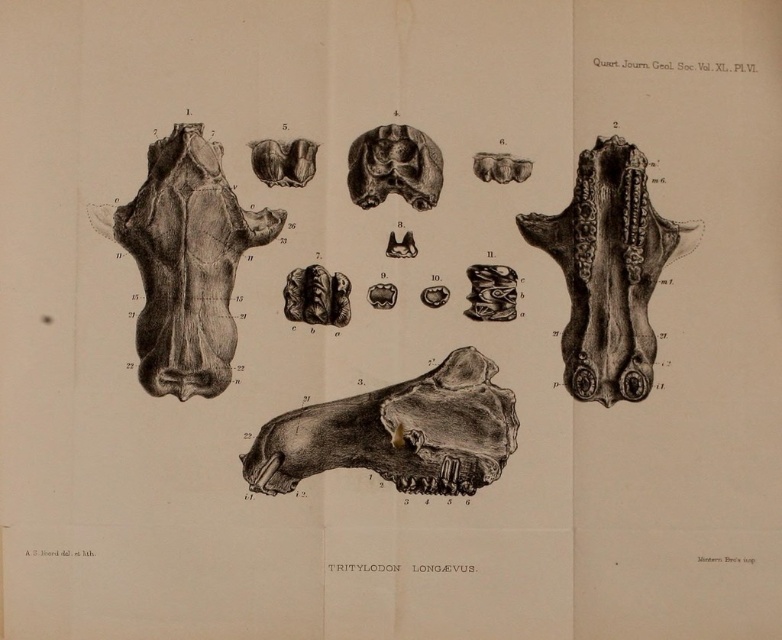
Question: Is black bone skull at upper left below gray textured bone at center?

Choices:
 (A) yes
 (B) no

Answer: (B)

Question: Can you confirm if gray textured bone at center is positioned to the left of black textured skull at right?

Choices:
 (A) yes
 (B) no

Answer: (A)

Question: Which object appears farthest from the camera in this image?

Choices:
 (A) black bone skull at upper left
 (B) black textured skull at center
 (C) gray textured bone at center

Answer: (B)

Question: Which point appears farthest from the camera in this image?

Choices:
 (A) (432, 369)
 (B) (379, 180)
 (C) (653, 342)
 (D) (217, 173)

Answer: (C)

Question: Based on their relative distances, which object is farther from the black textured skull at center?

Choices:
 (A) black bone skull at upper left
 (B) gray textured bone at center
 (C) black textured skull at right

Answer: (B)

Question: From the image, what is the correct spatial relationship of black bone skull at upper left in relation to black textured skull at right?

Choices:
 (A) left
 (B) right

Answer: (A)